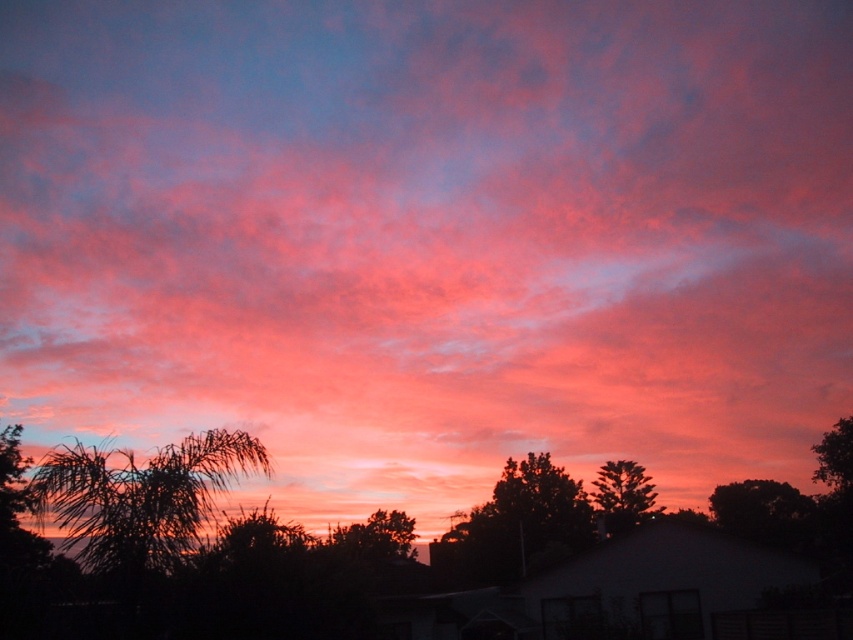
Is point (780, 531) closer to viewer compared to point (850, 493)?

No, (780, 531) is further to viewer.

Based on the photo, who is positioned more to the left, dark green leafy tree at lower right or green leafy tree at right?

Positioned to the left is dark green leafy tree at lower right.

This screenshot has height=640, width=853. Describe the element at coordinates (764, 513) in the screenshot. I see `dark green leafy tree at lower right` at that location.

Where is `dark green leafy tree at lower right`? The image size is (853, 640). dark green leafy tree at lower right is located at coordinates (764, 513).

Which is in front, point (450, 584) or point (740, 522)?

Point (450, 584) is in front.

Can you confirm if silhouette leafy tree at center is shorter than dark green leafy tree at lower right?

Correct, silhouette leafy tree at center is not as tall as dark green leafy tree at lower right.

Where is `silhouette leafy tree at center`? The width and height of the screenshot is (853, 640). silhouette leafy tree at center is located at coordinates (515, 525).

Find the location of a particular element. This screenshot has height=640, width=853. silhouette leafy tree at center is located at coordinates (515, 525).

Does silhouette palm tree at lower left have a lesser width compared to green leafy tree at right?

No.

Measure the distance from silhouette palm tree at lower left to green leafy tree at right.

They are 77.27 meters apart.

Where is `silhouette palm tree at lower left`? The image size is (853, 640). silhouette palm tree at lower left is located at coordinates (138, 499).